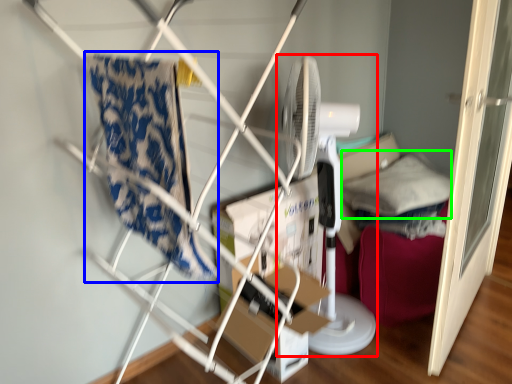
Question: Which object is the farthest from mechanical fan (highlighted by a red box)? Choose among these: beach towel (highlighted by a blue box) or pillow (highlighted by a green box).

Choices:
 (A) beach towel
 (B) pillow

Answer: (A)